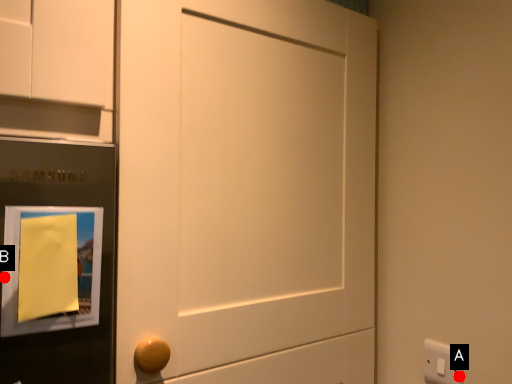
Question: Two points are circled on the image, labeled by A and B beside each circle. Which point is further to the camera?

Choices:
 (A) A is further
 (B) B is further

Answer: (A)